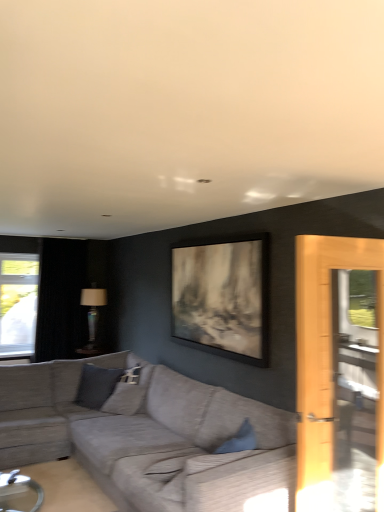
Question: Does matte glass lamp at center have a greater height compared to gray fabric pillow at center?

Choices:
 (A) no
 (B) yes

Answer: (B)

Question: Does matte glass lamp at center have a lesser height compared to gray fabric pillow at center?

Choices:
 (A) yes
 (B) no

Answer: (B)

Question: Is matte glass lamp at center smaller than gray fabric pillow at center?

Choices:
 (A) no
 (B) yes

Answer: (A)

Question: Is matte glass lamp at center bigger than gray fabric pillow at center?

Choices:
 (A) no
 (B) yes

Answer: (B)

Question: Is the depth of matte glass lamp at center less than that of gray fabric pillow at center?

Choices:
 (A) yes
 (B) no

Answer: (B)

Question: From a real-world perspective, is textured gray couch at center physically located above or below gray fabric pillow at center?

Choices:
 (A) above
 (B) below

Answer: (B)

Question: Is textured gray couch at center wider or thinner than gray fabric pillow at center?

Choices:
 (A) thin
 (B) wide

Answer: (B)

Question: From their relative heights in the image, would you say textured gray couch at center is taller or shorter than gray fabric pillow at center?

Choices:
 (A) short
 (B) tall

Answer: (B)

Question: From the image's perspective, is textured gray couch at center positioned above or below gray fabric pillow at center?

Choices:
 (A) above
 (B) below

Answer: (B)

Question: From their relative heights in the image, would you say black velvet curtain at left is taller or shorter than matte glass lamp at center?

Choices:
 (A) short
 (B) tall

Answer: (B)

Question: In the image, is black velvet curtain at left positioned in front of or behind matte glass lamp at center?

Choices:
 (A) behind
 (B) front

Answer: (B)

Question: In the image, is black velvet curtain at left on the left side or the right side of matte glass lamp at center?

Choices:
 (A) left
 (B) right

Answer: (A)

Question: In terms of size, does black velvet curtain at left appear bigger or smaller than matte glass lamp at center?

Choices:
 (A) small
 (B) big

Answer: (B)

Question: Is black velvet curtain at left wider or thinner than textured gray couch at center?

Choices:
 (A) wide
 (B) thin

Answer: (B)

Question: Would you say black velvet curtain at left is inside or outside textured gray couch at center?

Choices:
 (A) inside
 (B) outside

Answer: (B)